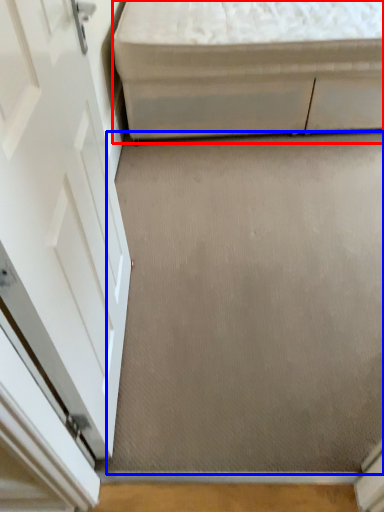
Question: Which object is further to the camera taking this photo, furniture (highlighted by a red box) or concrete (highlighted by a blue box)?

Choices:
 (A) furniture
 (B) concrete

Answer: (A)